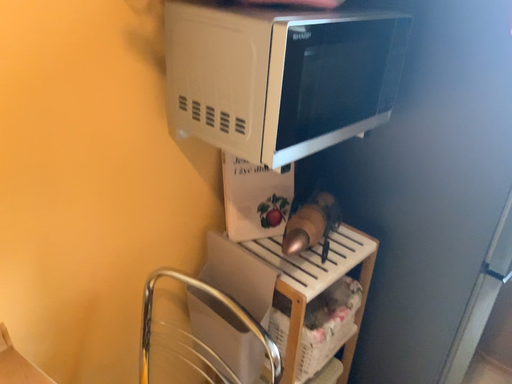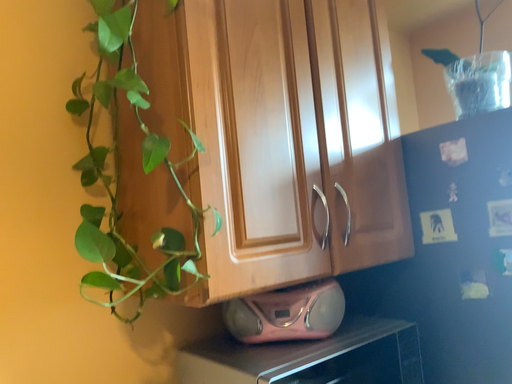
Question: Which way did the camera rotate in the video?

Choices:
 (A) rotated left
 (B) rotated right

Answer: (A)